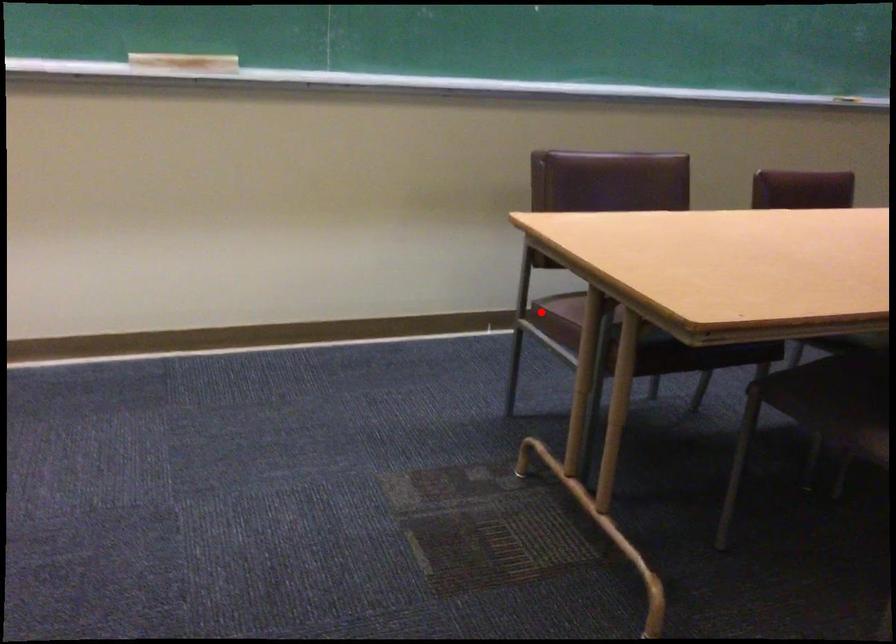
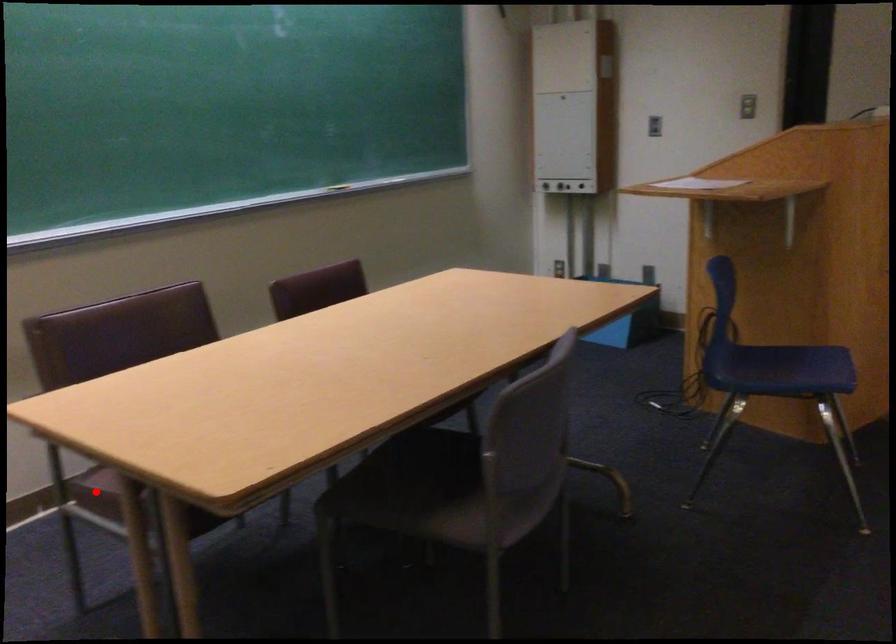
I am providing you with two images of the same scene from different viewpoints. A red point is marked on the first image and another point is marked on the second image. Does the point marked in image1 correspond to the same location as the one in image2?

Yes